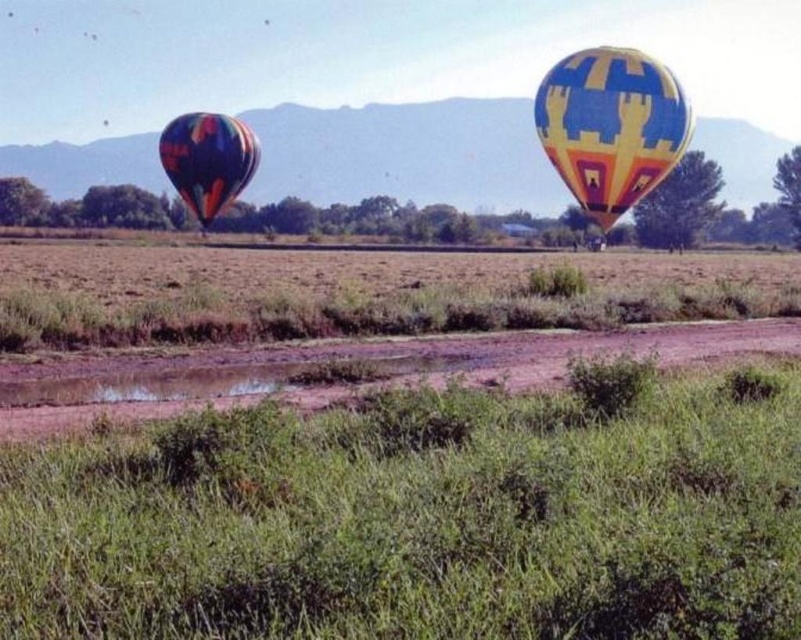
Does yellow and blue patterned hot air balloon at upper right appear under multicolored fabric balloon at left?

Correct, yellow and blue patterned hot air balloon at upper right is located below multicolored fabric balloon at left.

Is yellow and blue patterned hot air balloon at upper right to the right of multicolored fabric balloon at left from the viewer's perspective?

Indeed, yellow and blue patterned hot air balloon at upper right is positioned on the right side of multicolored fabric balloon at left.

Locate an element on the screen. The width and height of the screenshot is (801, 640). yellow and blue patterned hot air balloon at upper right is located at coordinates (610, 125).

This screenshot has width=801, height=640. I want to click on yellow and blue patterned hot air balloon at upper right, so click(x=610, y=125).